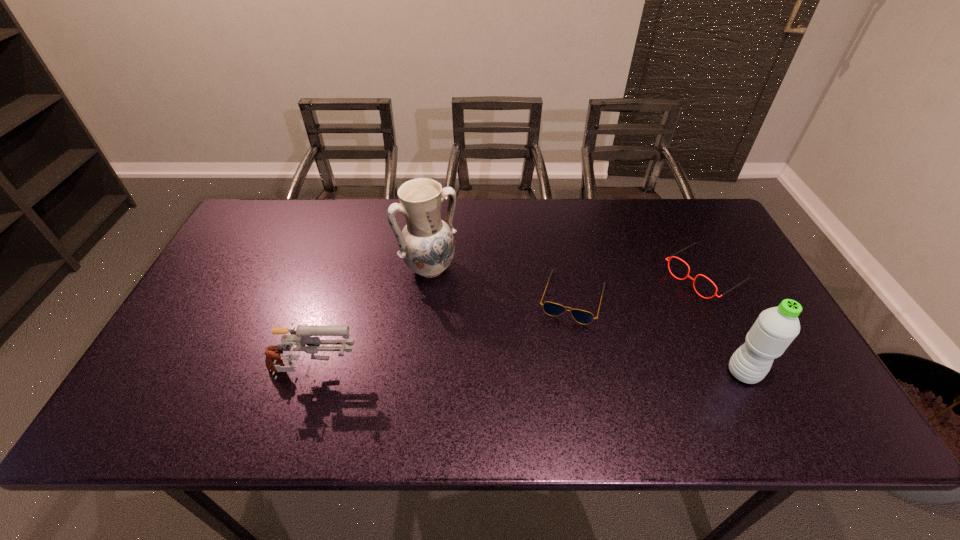
Locate an element on the screen. gun is located at coordinates (300, 337).

The image size is (960, 540). Find the location of `the leftmost object`. the leftmost object is located at coordinates (300, 337).

At what (x,y) coordinates should I click in order to perform the action: click on water bottle. Please return your answer as a coordinate pair (x, y). The width and height of the screenshot is (960, 540). Looking at the image, I should click on (775, 328).

At what (x,y) coordinates should I click in order to perform the action: click on the second object from left to right. Please return your answer as a coordinate pair (x, y). Looking at the image, I should click on (426, 243).

This screenshot has width=960, height=540. What are the coordinates of `the second shortest object` in the screenshot? It's located at (672, 256).

Where is `sunglasses`? This screenshot has width=960, height=540. sunglasses is located at coordinates (553, 309).

Find the location of a particular element. Image resolution: width=960 pixels, height=540 pixels. the third object from right to left is located at coordinates (553, 309).

Locate an element on the screen. The height and width of the screenshot is (540, 960). vacant region located at the barrel end of the leftmost object is located at coordinates (431, 375).

Identify the location of blank space located on the back of the water bottle. This screenshot has height=540, width=960. (700, 285).

Where is `vacant region located 0.270m on either side of the fourth object from right to left`? Image resolution: width=960 pixels, height=540 pixels. vacant region located 0.270m on either side of the fourth object from right to left is located at coordinates (498, 350).